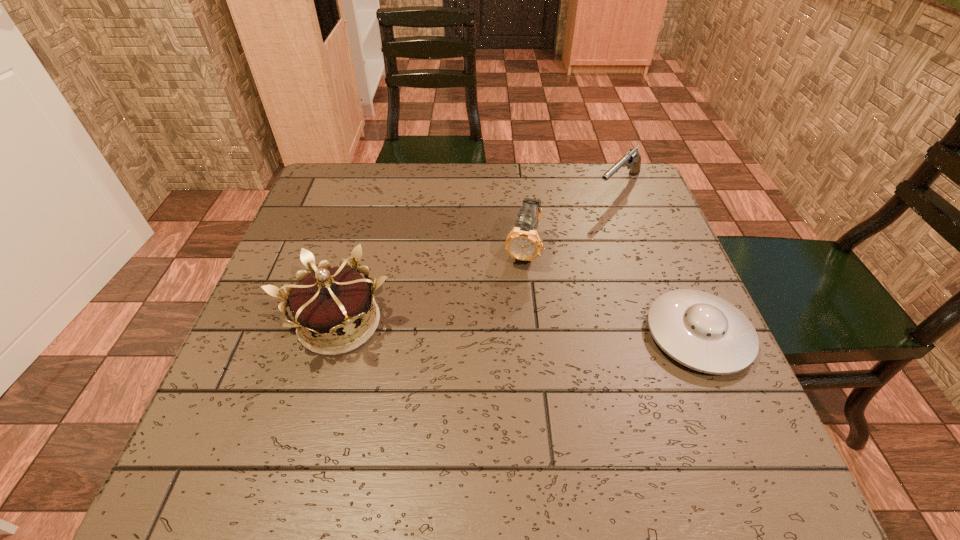
Where is `vacant point that satisfies the following two spatial constraints: 1. on the front side of the saucer; 2. on the left side of the crown`? The image size is (960, 540). vacant point that satisfies the following two spatial constraints: 1. on the front side of the saucer; 2. on the left side of the crown is located at coordinates (336, 335).